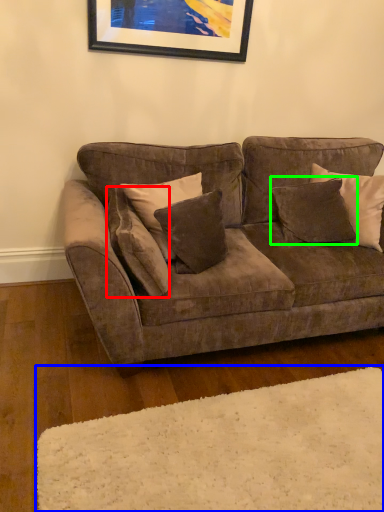
Question: Based on their relative distances, which object is farther from pillow (highlighted by a red box)? Choose from plain (highlighted by a blue box) and pillow (highlighted by a green box).

Choices:
 (A) plain
 (B) pillow

Answer: (B)